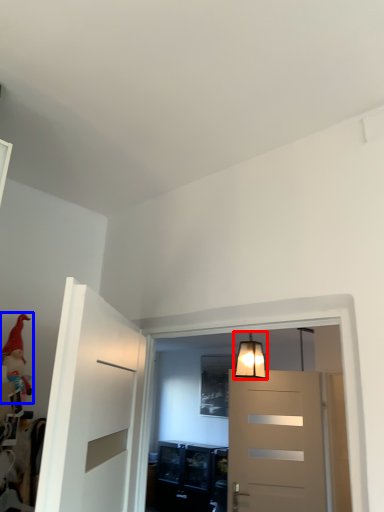
Question: Which object appears farthest to the camera in this image, lamp (highlighted by a red box) or toy (highlighted by a blue box)?

Choices:
 (A) lamp
 (B) toy

Answer: (A)